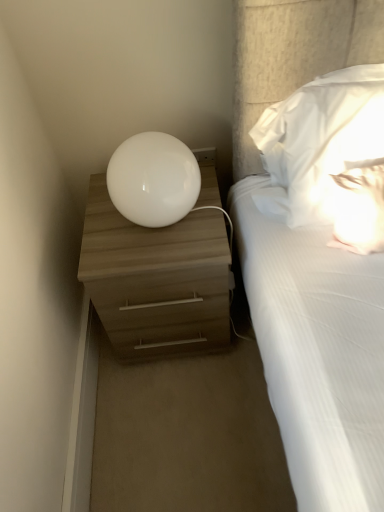
The width and height of the screenshot is (384, 512). I want to click on empty space that is ontop of matte wood nightstand at left (from a real-world perspective), so click(146, 233).